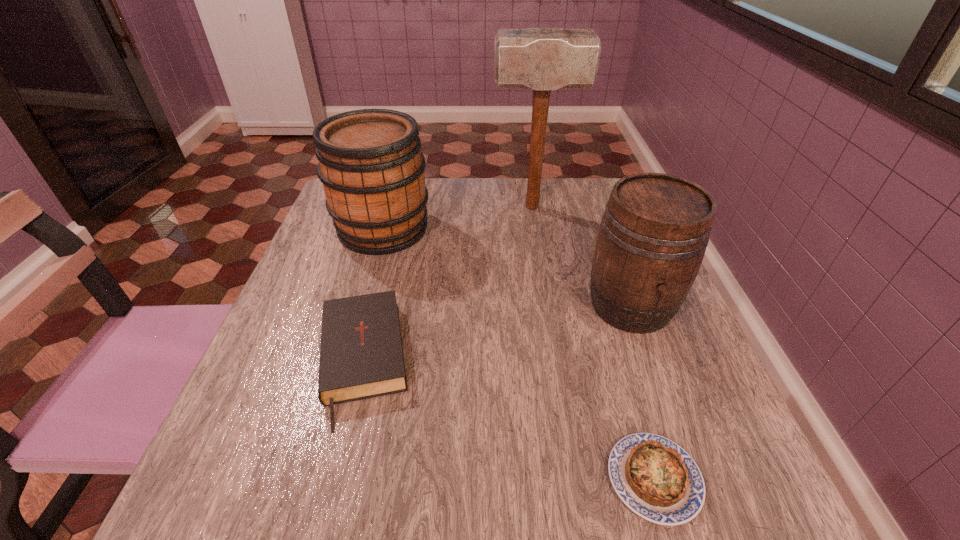
The image size is (960, 540). I want to click on quiche at the right edge, so click(x=657, y=479).

The width and height of the screenshot is (960, 540). In order to click on object that is at the far left corner in this screenshot , I will do `click(370, 163)`.

Find the location of a particular element. object that is at the far right corner is located at coordinates (540, 59).

You are a GUI agent. You are given a task and a screenshot of the screen. Output one action in this format:
    pyautogui.click(x=<x>, y=<y>)
    Task: Click on the object at the near right corner
    
    Given the screenshot: What is the action you would take?
    pyautogui.click(x=657, y=479)

This screenshot has height=540, width=960. Identify the location of blank area at the far edge. (442, 197).

The image size is (960, 540). In the image, there is a desktop. Find the location of `blank space at the left edge`. blank space at the left edge is located at coordinates (296, 341).

The width and height of the screenshot is (960, 540). In order to click on vacant space at the right edge of the desktop in this screenshot , I will do `click(592, 244)`.

Where is `vacant region at the near left corner of the desktop`? Image resolution: width=960 pixels, height=540 pixels. vacant region at the near left corner of the desktop is located at coordinates (285, 465).

Where is `free space at the far right corner`? This screenshot has width=960, height=540. free space at the far right corner is located at coordinates (587, 195).

Find the location of a particular element. The width and height of the screenshot is (960, 540). vacant point located between the tallest object and the nearer cider is located at coordinates (582, 256).